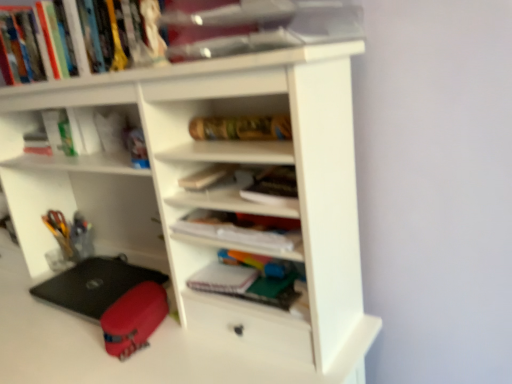
Where is `empty space that is ontop of rubberized red suitcase at lower left`? The height and width of the screenshot is (384, 512). empty space that is ontop of rubberized red suitcase at lower left is located at coordinates (136, 295).